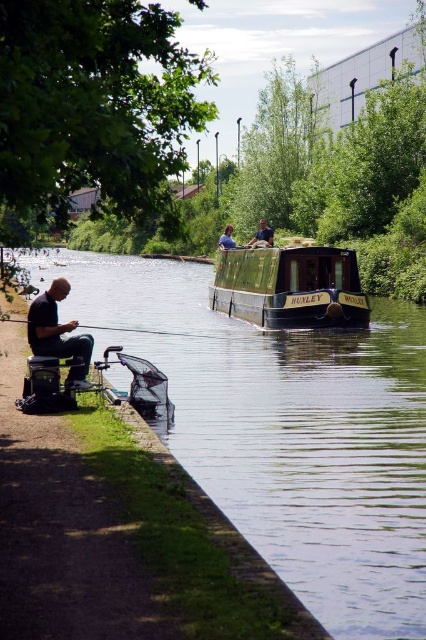
Question: Can you confirm if green polished wood boat at center is wider than dark blue shirt at center?

Choices:
 (A) no
 (B) yes

Answer: (B)

Question: Among these points, which one is nearest to the camera?

Choices:
 (A) (261, 234)
 (B) (63, 296)
 (C) (325, 598)
 (D) (131, 326)

Answer: (C)

Question: Based on their relative distances, which object is nearer to the green wooden boat at center?

Choices:
 (A) dark blue shirt at upper center
 (B) matte black shirt at left
 (C) dark blue shirt at center

Answer: (C)

Question: Does green polished wood boat at center come in front of matte black shirt at left?

Choices:
 (A) no
 (B) yes

Answer: (A)

Question: Which of the following is the farthest from the observer?

Choices:
 (A) click(x=227, y=236)
 (B) click(x=71, y=381)

Answer: (A)

Question: In this image, where is matte black shirt at left located relative to dark blue shirt at center?

Choices:
 (A) left
 (B) right

Answer: (A)